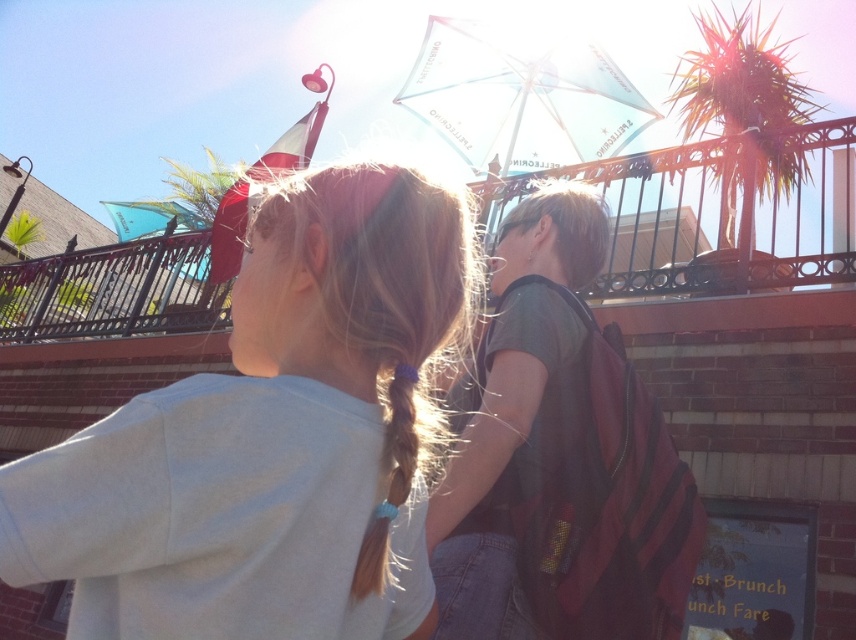
Who is more forward, (126, 492) or (396, 502)?

Positioned in front is point (126, 492).

Who is lower down, light gray t-shirt at upper center or brown silky hair at center?

brown silky hair at center is lower down.

Who is more distant from viewer, [340,586] or [354,577]?

Point [354,577]

Where is `light gray t-shirt at upper center`? The width and height of the screenshot is (856, 640). light gray t-shirt at upper center is located at coordinates (263, 433).

Does dark gray backpack at center come in front of brown silky hair at center?

No, it is behind brown silky hair at center.

Is point (492, 580) more distant than point (395, 513)?

Yes, point (492, 580) is behind point (395, 513).

The width and height of the screenshot is (856, 640). I want to click on dark gray backpack at center, so click(559, 458).

What do you see at coordinates (263, 433) in the screenshot? The image size is (856, 640). I see `light gray t-shirt at upper center` at bounding box center [263, 433].

Which is more to the left, light gray t-shirt at upper center or dark gray backpack at center?

Positioned to the left is light gray t-shirt at upper center.

Identify the location of light gray t-shirt at upper center. (263, 433).

Locate an element on the screen. This screenshot has width=856, height=640. light gray t-shirt at upper center is located at coordinates (263, 433).